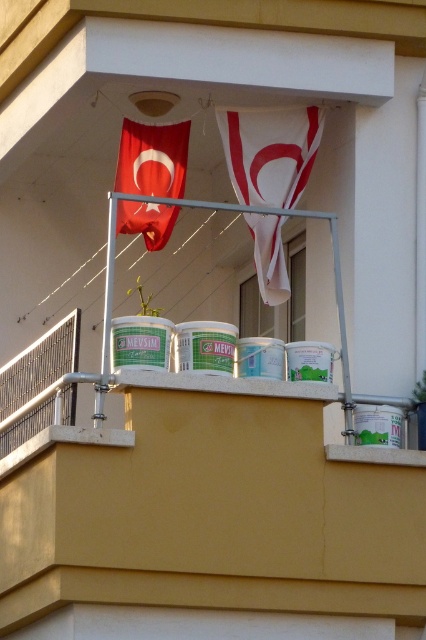
You are standing on the balcony and want to reach the white fabric flag at center. The balcony is 2 meters wide. Can you safely step towards the flag without falling over the railing?

The white fabric flag at center is 35.44 meters from viewer, which is very far away. Since the balcony is only 2 meters wide, stepping towards the flag would likely cause you to fall over the railing. Stay back for safety.

In the scene shown: You are standing on the balcony and want to hang a new flag that is 6 feet long between the white fabric flag at center and the matte red flag at upper left. Is there enough space?

The distance between the white fabric flag at center and the matte red flag at upper left is 5.96 feet, which is slightly less than the 6 feet required for the new flag. Therefore, there is not enough space to hang the new flag between them.

You are a delivery person trying to place a package on the balcony ledge. The package is 1 meter wide. There are five cylindrical containers arranged in a row on the ledge. Can you fit the package between the white fabric flag at center and the matte red flag at upper left?

The white fabric flag at center has a larger size compared to matte red flag at upper left, but the distance between them isn t specified. Without knowing the exact spacing between the flags, it s impossible to determine if the 1 meter wide package will fit.